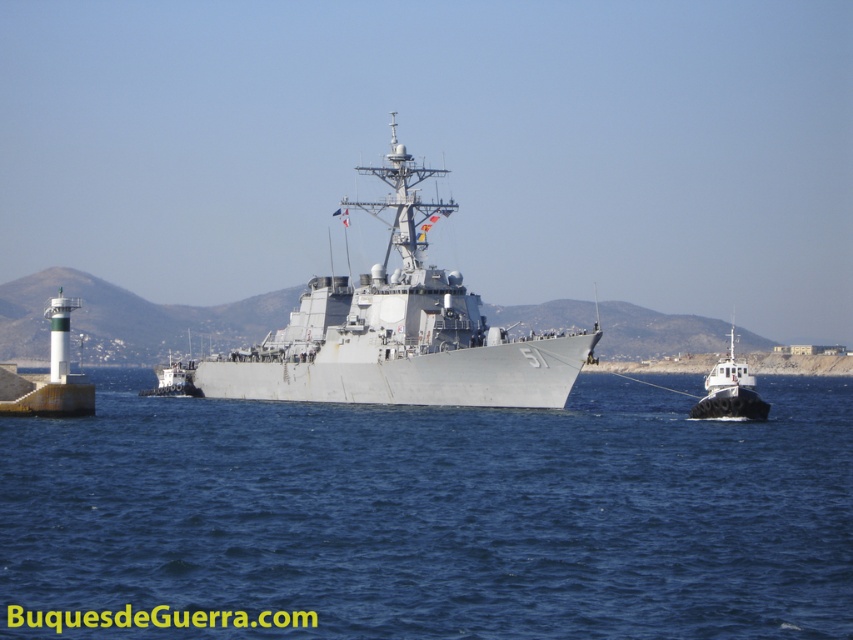
You are a naval officer observing the scene from a nearby pier. You notice the blue water at center and the gray metallic warship at center. Which object is positioned to the right side of the other?

The blue water at center is to the right of gray metallic warship at center.

You are a naval officer observing the scene. You notice the blue water at center and the gray metallic warship at center. Which object takes up more area in the image?

The gray metallic warship at center occupies more space than the blue water at center, as stated in the description.